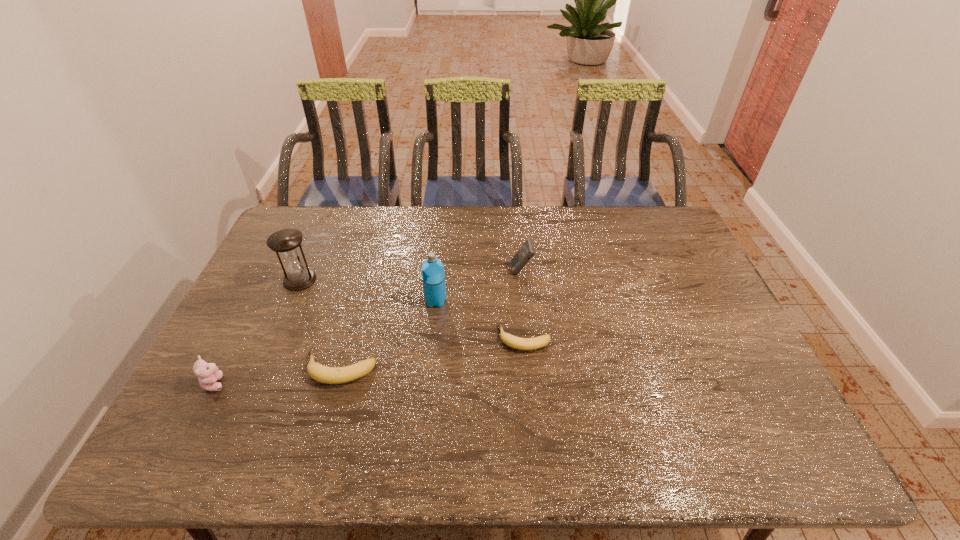
This screenshot has width=960, height=540. Identify the location of vacant space that satisfies the following two spatial constraints: 1. on the front side of the thermos bottle; 2. on the left side of the right banana. (432, 339).